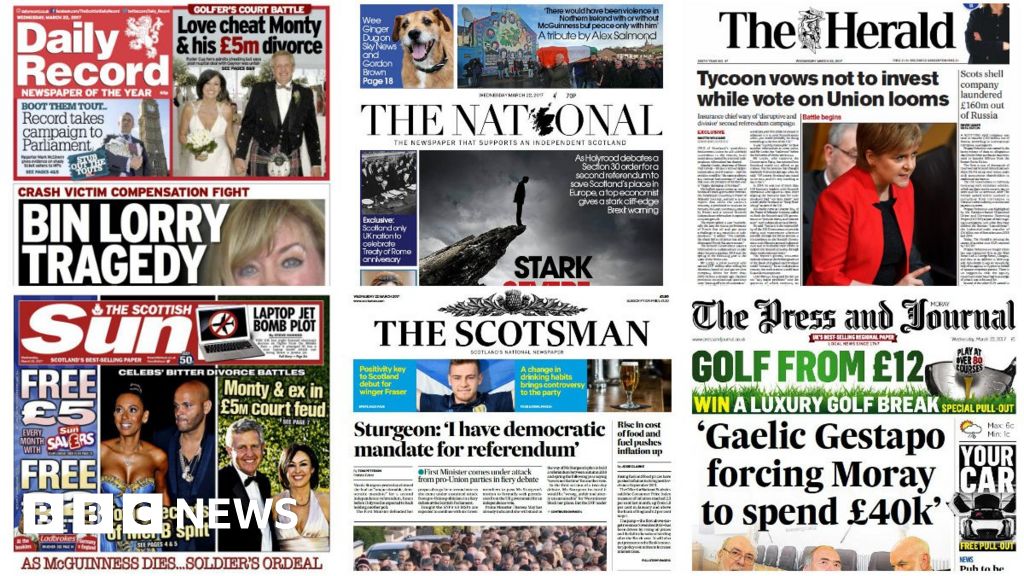
This screenshot has width=1024, height=576. I want to click on newspaper, so 219,158, 497,98, 797,140, 768,473, 511,458, 269,454.